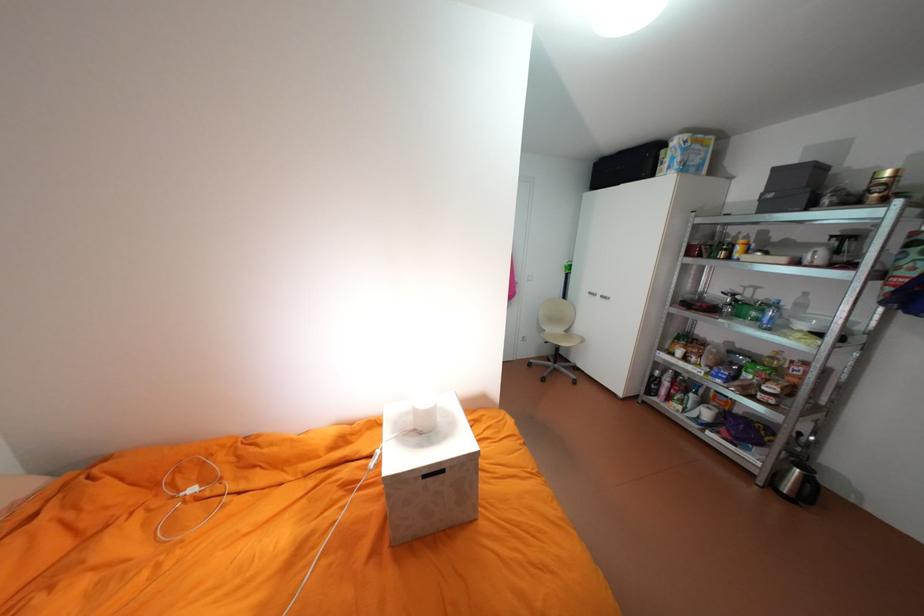
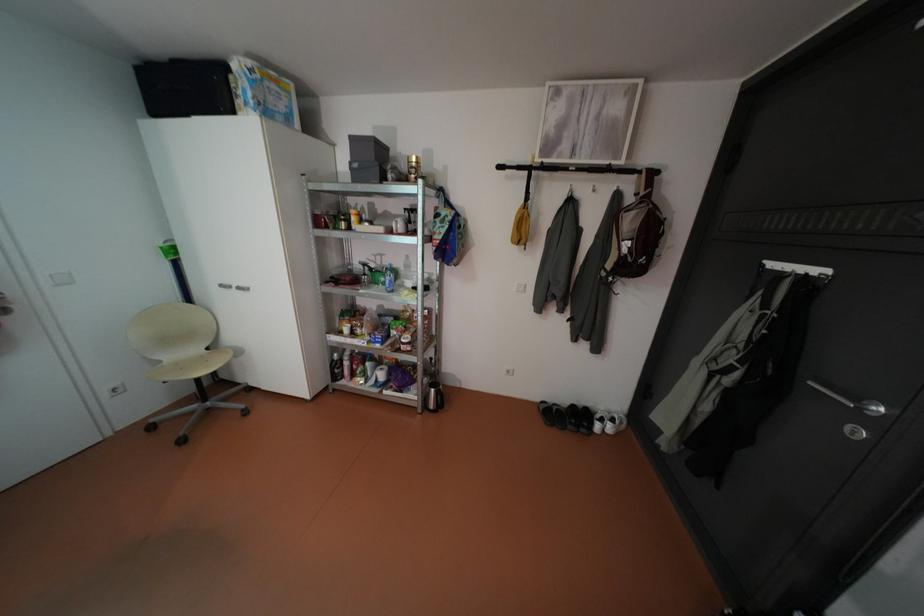
Where in the second image is the point corresponding to (779,195) from the first image?

(365, 164)